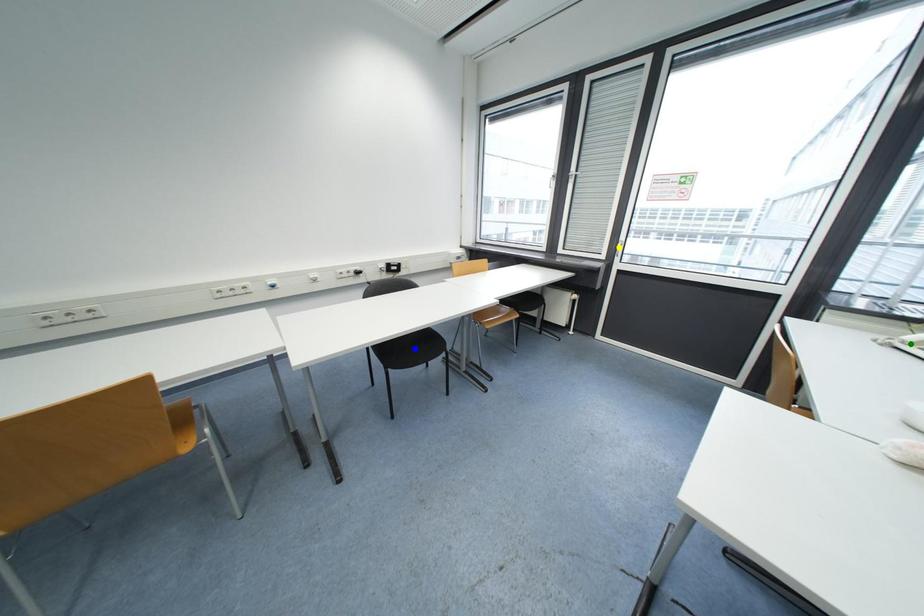
Looking at this image, order these from nearest to farthest:
1. green point
2. yellow point
3. blue point

green point → yellow point → blue point